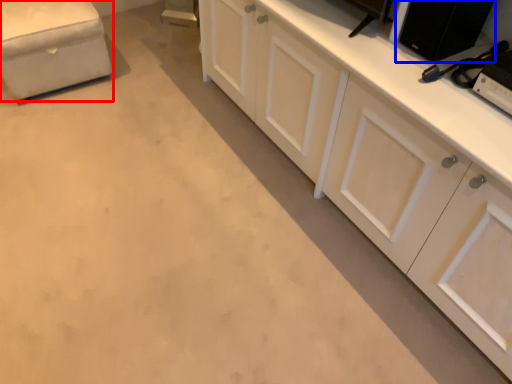
Question: Which object is closer to the camera taking this photo, furniture (highlighted by a red box) or appliance (highlighted by a blue box)?

Choices:
 (A) furniture
 (B) appliance

Answer: (B)